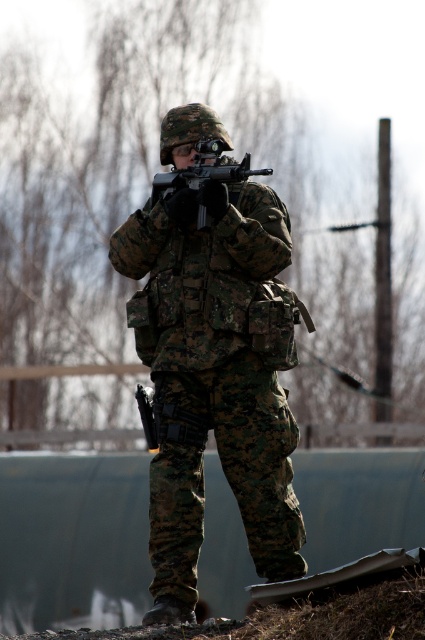
You are a military equipment inspector tasked with ensuring that all gear fits properly. You observe the camouflage uniform at center and the matte black rifle at center. Which item takes up more space in the image?

The camouflage uniform at center is bigger than the matte black rifle at center, so the camouflage uniform at center takes up more space in the image.

You are a photographer trying to capture the soldier in the scene. You need to ensure the camouflage uniform at center and the matte black rifle at center are both visible in your shot. Based on their positions, which object should be placed closer to the left side of the frame?

The matte black rifle at center is on the left side of the camouflage uniform at center, so to have both in the frame, the rifle should be closer to the left side.

You are a military equipment inspector tasked with ensuring all gear fits properly. You observe the soldier wearing the camouflage uniform at center holding the matte black rifle at center. Based on their size relationship, can the rifle be comfortably carried by the soldier without being too cumbersome?

The camouflage uniform at center is wider than the matte black rifle at center, which suggests the rifle is narrower and thus can be comfortably carried by the soldier without being too cumbersome.